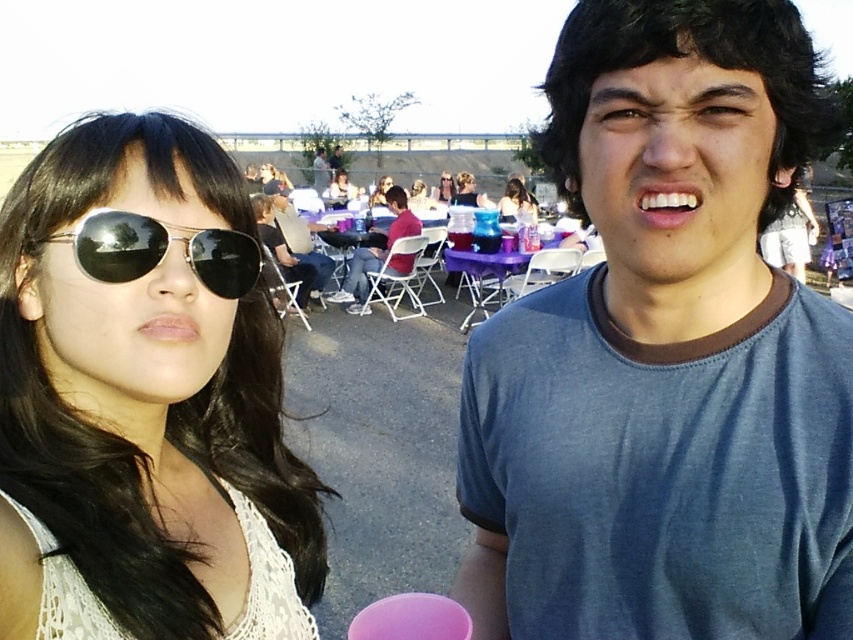
Question: Which point is closer to the camera?

Choices:
 (A) blue cotton t-shirt at center
 (B) matte black sunglasses at center
 (C) matte black shirt at center

Answer: (A)

Question: Is maroon fabric shirt at center thinner than matte black shirt at center?

Choices:
 (A) yes
 (B) no

Answer: (B)

Question: Does matte black sunglasses at left have a greater width compared to matte black sunglasses at center?

Choices:
 (A) yes
 (B) no

Answer: (B)

Question: Does matte black sunglasses at left have a greater width compared to matte black sunglasses at upper left?

Choices:
 (A) yes
 (B) no

Answer: (B)

Question: Among these objects, which one is farthest from the camera?

Choices:
 (A) metallic reflective sunglasses at left
 (B) matte black sunglasses at upper left
 (C) matte black sunglasses at upper center
 (D) matte black hair at upper center

Answer: (B)

Question: Which object is the closest to the matte black shirt at center?

Choices:
 (A) matte black sunglasses at left
 (B) matte black hair at center
 (C) matte black hair at upper center
 (D) matte black sunglasses at center

Answer: (D)